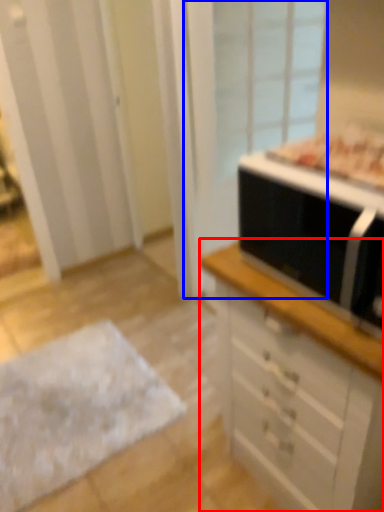
Question: Which object appears closest to the camera in this image, chest of drawers (highlighted by a red box) or screen door (highlighted by a blue box)?

Choices:
 (A) chest of drawers
 (B) screen door

Answer: (A)